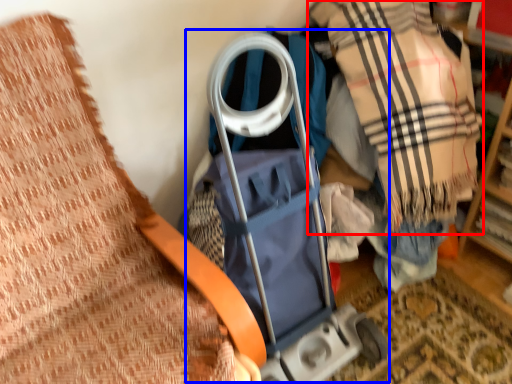
Question: Which point is further to the camera, plaid (highlighted by a red box) or baby carriage (highlighted by a blue box)?

Choices:
 (A) plaid
 (B) baby carriage

Answer: (B)